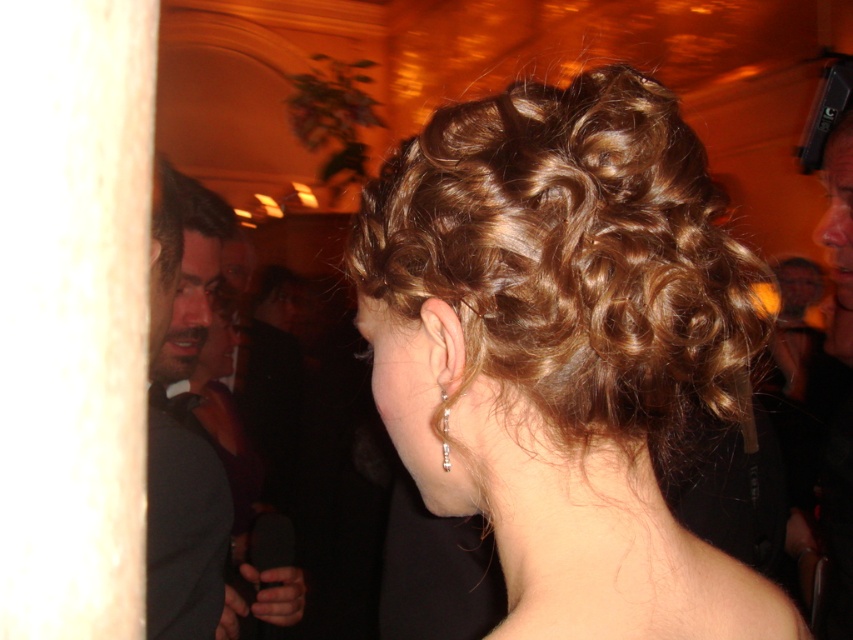
How far apart are shiny brown hair at center and shiny black suit at left?

shiny brown hair at center is 29.76 inches away from shiny black suit at left.

Which of these two, shiny brown hair at center or shiny black suit at left, stands taller?

Standing taller between the two is shiny black suit at left.

At what (x,y) coordinates should I click in order to perform the action: click on shiny brown hair at center. Please return your answer as a coordinate pair (x, y). Looking at the image, I should click on (564, 348).

What are the coordinates of `shiny brown hair at center` in the screenshot? It's located at (564, 348).